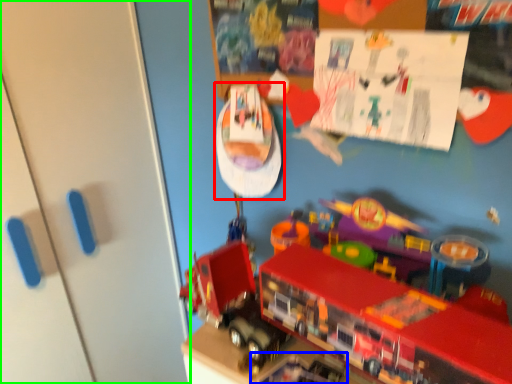
Question: Based on their relative distances, which object is nearer to toy (highlighted by a red box)? Choose from toy (highlighted by a blue box) and door (highlighted by a green box).

Choices:
 (A) toy
 (B) door

Answer: (B)